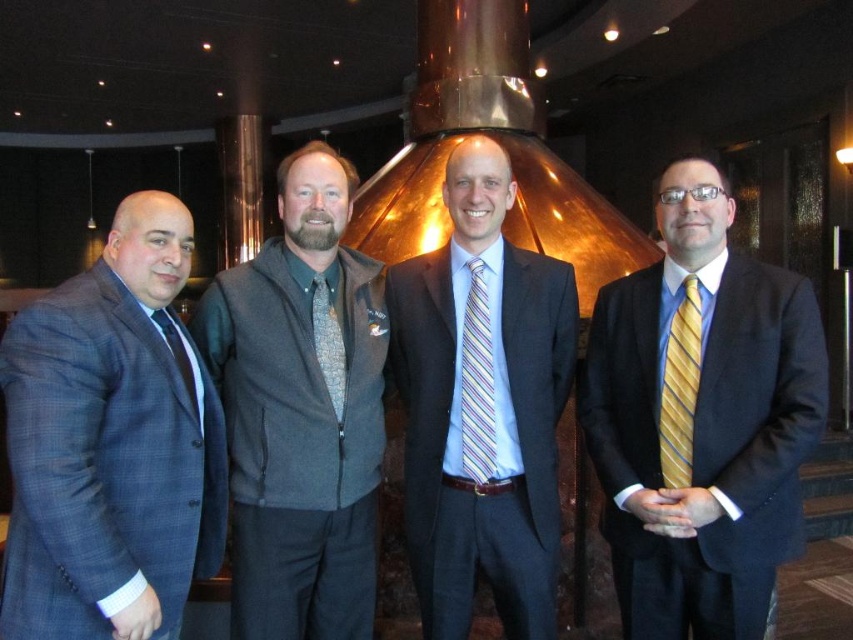
Question: Is striped tie at center above yellow striped tie at right?

Choices:
 (A) yes
 (B) no

Answer: (B)

Question: Is striped silk tie at center bigger than patterned fabric tie at center?

Choices:
 (A) yes
 (B) no

Answer: (A)

Question: Estimate the real-world distances between objects in this image. Which object is closer to the matte black tie at left?

Choices:
 (A) patterned fabric tie at center
 (B) yellow striped tie at right
 (C) plaid wool suit at left

Answer: (C)

Question: In this image, where is gray fleece vest at center located relative to matte black tie at left?

Choices:
 (A) above
 (B) below

Answer: (B)

Question: Which point appears closest to the camera in this image?

Choices:
 (A) (331, 273)
 (B) (537, 292)
 (C) (194, 499)
 (D) (340, 362)

Answer: (C)

Question: Estimate the real-world distances between objects in this image. Which object is farther from the matte black suit at right?

Choices:
 (A) yellow striped tie at right
 (B) striped tie at center
 (C) plaid wool suit at left
 (D) striped silk tie at center

Answer: (C)